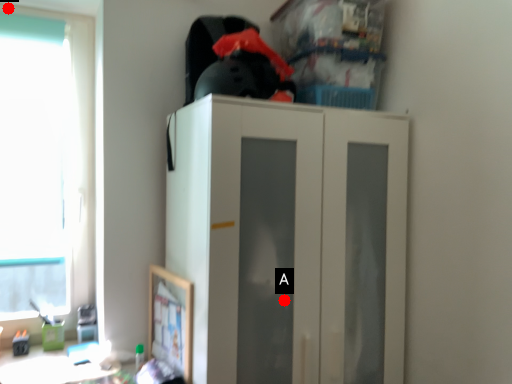
Question: Two points are circled on the image, labeled by A and B beside each circle. Which point appears closest to the camera in this image?

Choices:
 (A) A is closer
 (B) B is closer

Answer: (A)